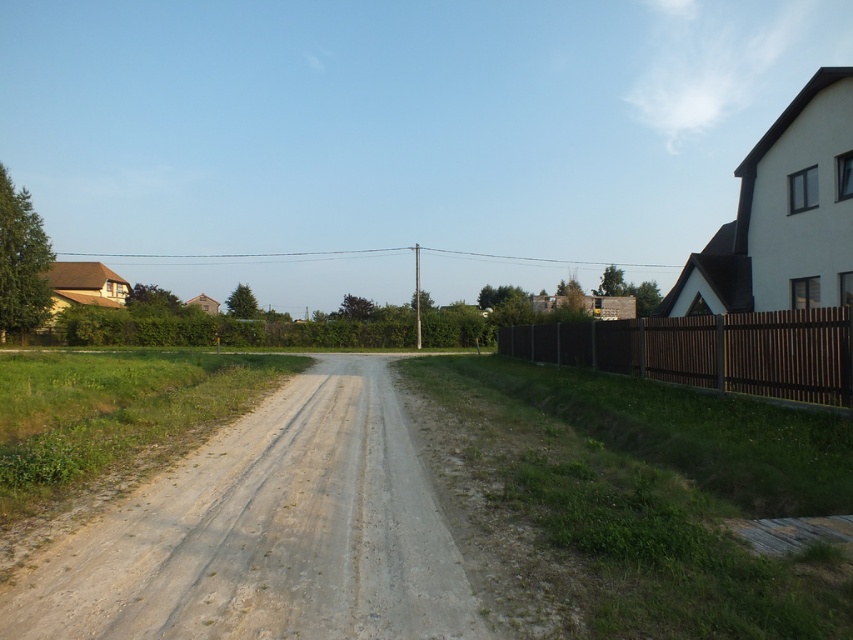
Is gray gravel road at center further to camera compared to brown wooden fence at right?

No, it is not.

Between gray gravel road at center and brown wooden fence at right, which one has less height?

With less height is gray gravel road at center.

Which is behind, point (448, 557) or point (614, 358)?

Positioned behind is point (614, 358).

I want to click on gray gravel road at center, so click(268, 532).